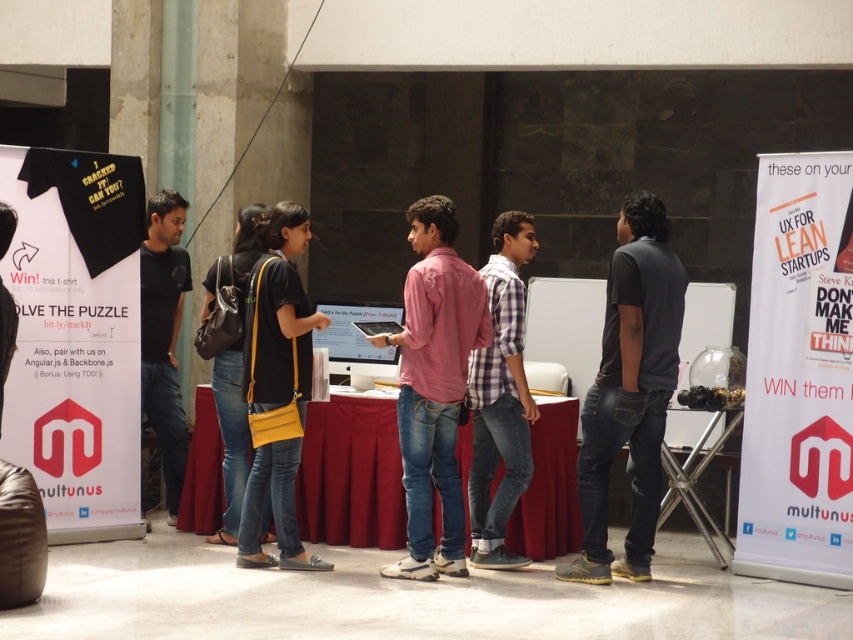
Does pink cotton shirt at center appear under checkered fabric shirt at center?

No, pink cotton shirt at center is not below checkered fabric shirt at center.

Which of these two, pink cotton shirt at center or checkered fabric shirt at center, stands shorter?

checkered fabric shirt at center

Identify the location of pink cotton shirt at center. (434, 385).

Where is `pink cotton shirt at center`? This screenshot has width=853, height=640. pink cotton shirt at center is located at coordinates (434, 385).

Consider the image. Is smooth red tablecloth at center shorter than checkered fabric shirt at center?

Yes.

Is point (218, 472) in front of point (515, 282)?

No, it is behind (515, 282).

Is point (544, 474) positioned before point (496, 552)?

No, it is behind (496, 552).

I want to click on smooth red tablecloth at center, so click(351, 474).

Can you confirm if dark gray cotton t-shirt at center is positioned below pink cotton shirt at center?

Yes.

Between point (613, 264) and point (456, 269), which one is positioned behind?

Positioned behind is point (613, 264).

Image resolution: width=853 pixels, height=640 pixels. Find the location of `dark gray cotton t-shirt at center`. dark gray cotton t-shirt at center is located at coordinates (630, 390).